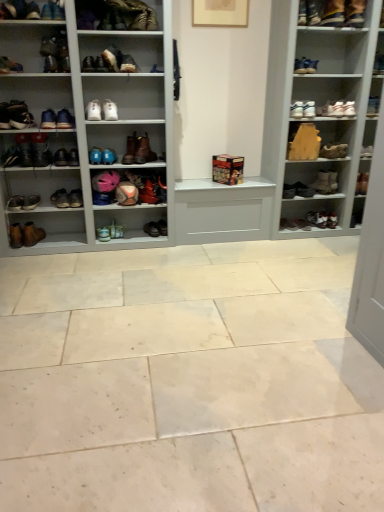
Locate an element on the screen. The image size is (384, 512). free space in front of brown leather shoe at center, placed as the twentieth shoe when sorted from left to right is located at coordinates (155, 238).